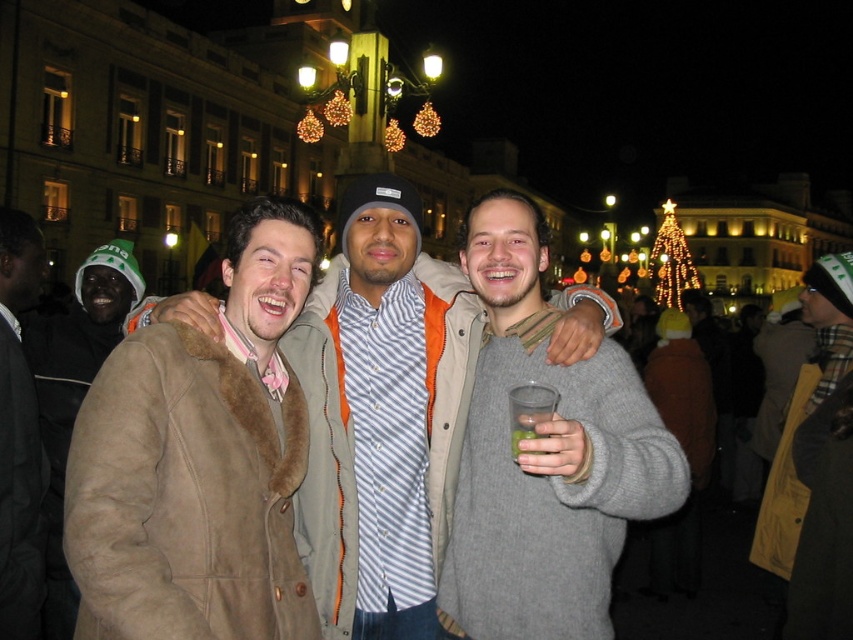
You are a photographer taking a picture of the dark brown fur coat at left and the green translucent plastic cup at center. Which object should you focus on first if you want to capture both in sharp focus?

The dark brown fur coat at left is much taller than the green translucent plastic cup at center, so you should focus on the dark brown fur coat at left first to ensure both are in focus.

You are a photographer trying to capture a detailed closeup of the brown suede coat at center. What are the coordinates where you should focus your camera?

The coordinates to focus the camera on the brown suede coat at center are point (199, 460).

You are a photographer trying to capture the perfect shot of the gray sweater at center. The camera is set to focus on the point at coordinates point (544, 458). Is this point likely to be on the gray sweater at center?

Yes, the point (544, 458) corresponds to the gray sweater at center, so the camera will focus on the gray sweater at center.